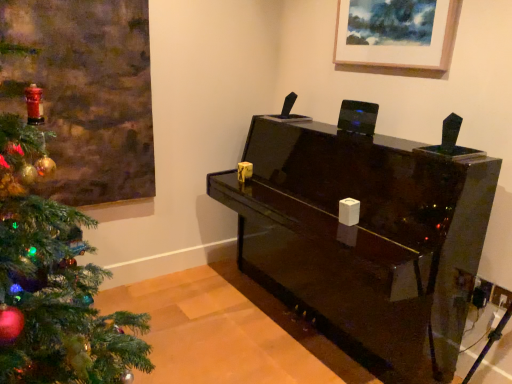
Question: In terms of height, does wooden picture frame at upper center look taller or shorter compared to glossy black piano at center?

Choices:
 (A) short
 (B) tall

Answer: (A)

Question: Is point (352, 34) closer or farther from the camera than point (286, 157)?

Choices:
 (A) closer
 (B) farther

Answer: (A)

Question: From the image's perspective, is wooden picture frame at upper center located above or below glossy black piano at center?

Choices:
 (A) below
 (B) above

Answer: (B)

Question: Based on their positions, is glossy black piano at center located to the left or right of wooden picture frame at upper center?

Choices:
 (A) left
 (B) right

Answer: (A)

Question: Choose the correct answer: Is glossy black piano at center inside wooden picture frame at upper center or outside it?

Choices:
 (A) inside
 (B) outside

Answer: (B)

Question: Relative to wooden picture frame at upper center, is glossy black piano at center in front or behind?

Choices:
 (A) behind
 (B) front

Answer: (B)

Question: From a real-world perspective, is glossy black piano at center physically located above or below wooden picture frame at upper center?

Choices:
 (A) below
 (B) above

Answer: (A)